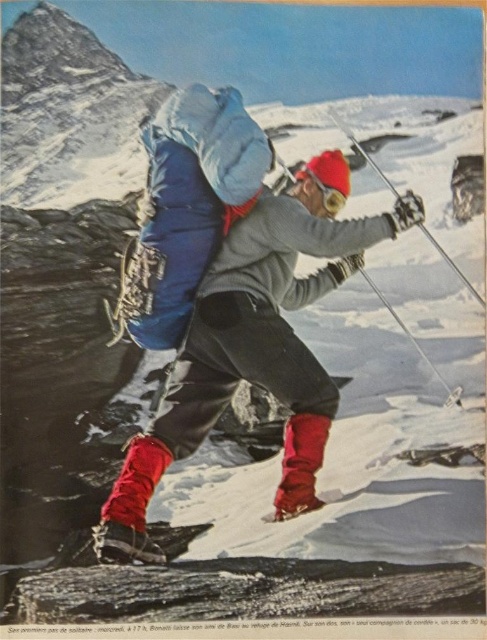
Question: Which object appears farthest from the camera in this image?

Choices:
 (A) metallic silver ski pole at upper right
 (B) matte blue backpack at center

Answer: (A)

Question: Does matte blue backpack at center have a lesser width compared to metallic silver ski pole at upper right?

Choices:
 (A) no
 (B) yes

Answer: (B)

Question: Which object is farther from the camera taking this photo?

Choices:
 (A) metallic silver ski pole at upper right
 (B) matte blue backpack at center

Answer: (A)

Question: Is matte blue backpack at center above metallic silver ski pole at upper right?

Choices:
 (A) yes
 (B) no

Answer: (B)

Question: Is matte blue backpack at center thinner than metallic silver ski pole at upper right?

Choices:
 (A) no
 (B) yes

Answer: (B)

Question: Which point is farther to the camera?

Choices:
 (A) metallic silver ski pole at upper right
 (B) matte blue backpack at center

Answer: (A)